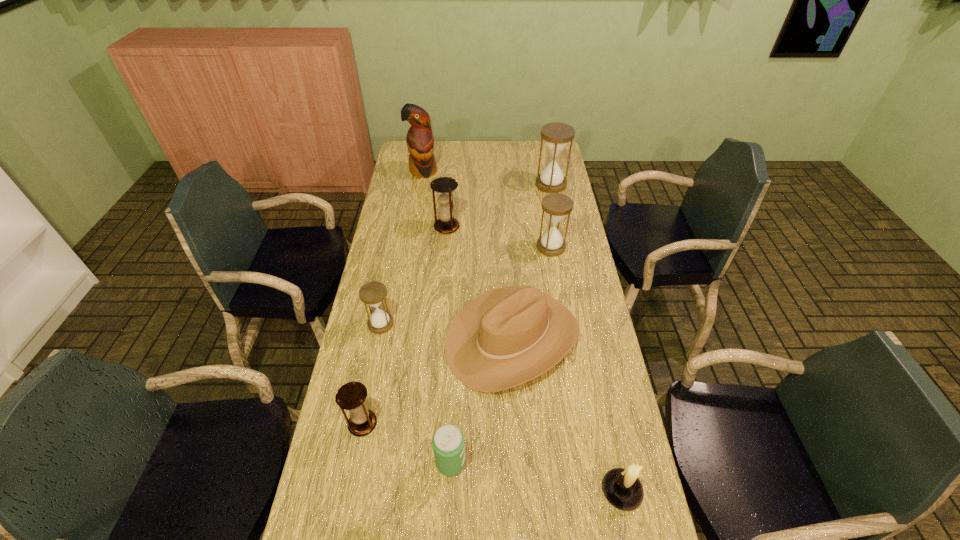
Identify the location of free space at the left edge. The height and width of the screenshot is (540, 960). (388, 234).

Locate an element on the screen. The height and width of the screenshot is (540, 960). vacant space at the right edge of the desktop is located at coordinates (562, 259).

The width and height of the screenshot is (960, 540). What are the coordinates of `free space at the far left corner` in the screenshot? It's located at (401, 157).

The height and width of the screenshot is (540, 960). Identify the location of unoccupied area between the brown cowboy hat and the seventh nearest object. (480, 282).

I want to click on vacant space that's between the seventh farthest object and the second farthest hourglass, so click(405, 325).

Find the location of a particular element. vacant space in between the brown cowboy hat and the nearest hourglass is located at coordinates (438, 381).

This screenshot has width=960, height=540. What are the coordinates of `free space between the brown cowboy hat and the biggest white hourglass` in the screenshot? It's located at (532, 261).

The image size is (960, 540). I want to click on free space between the smaller brown hourglass and the second nearest hourglass, so click(372, 374).

Locate an element on the screen. This screenshot has width=960, height=540. object that is the closest to the cowboy hat is located at coordinates (448, 443).

The width and height of the screenshot is (960, 540). What are the coordinates of `object that is the sixth closest to the soda` in the screenshot? It's located at (444, 186).